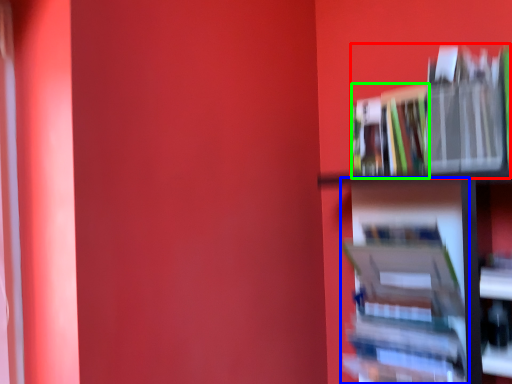
Question: Based on their relative distances, which object is nearer to book (highlighted by a red box)? Choose from book (highlighted by a blue box) and book (highlighted by a green box).

Choices:
 (A) book
 (B) book

Answer: (B)